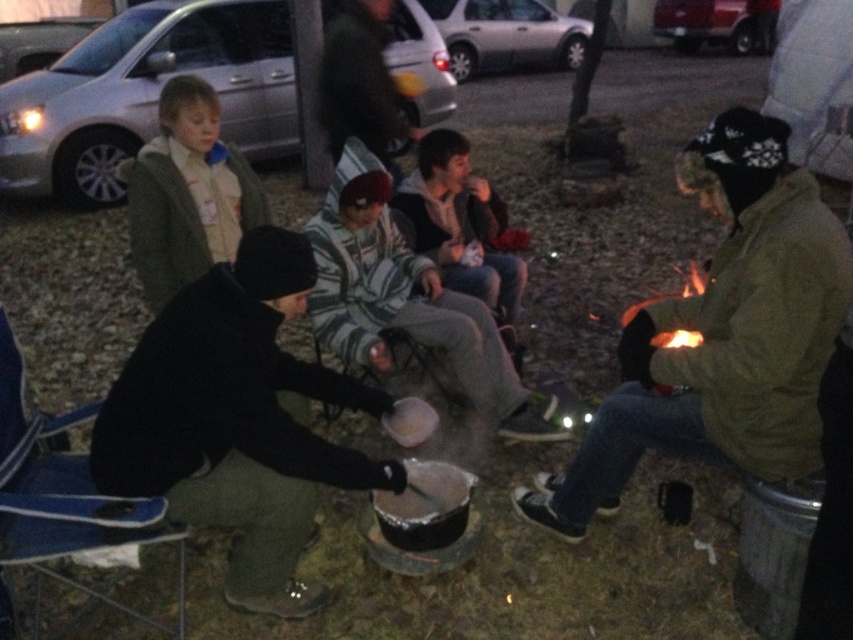
Between point (277, 262) and point (491, 392), which one is positioned behind?

Point (491, 392)

From the picture: Does black matte pot at center come behind striped fabric jacket at center?

No.

Between point (286, 500) and point (410, 288), which one is positioned in front?

Point (286, 500) is more forward.

This screenshot has height=640, width=853. I want to click on black matte pot at center, so click(x=236, y=420).

Is camouflage-patterned jacket at right wider than striped fabric jacket at center?

No, camouflage-patterned jacket at right is not wider than striped fabric jacket at center.

Between point (781, 266) and point (511, 396), which one is positioned in front?

Point (781, 266)

Locate an element on the screen. This screenshot has height=640, width=853. camouflage-patterned jacket at right is located at coordinates (722, 336).

Who is more distant from viewer, (805,230) or (294,300)?

The point (294,300) is more distant.

Is point (751, 429) positioned before point (349, 470)?

No, it is not.

From the picture: Who is more distant from viewer, (669,433) or (270,250)?

Positioned behind is point (669,433).

Find the location of a particular element. The width and height of the screenshot is (853, 640). camouflage-patterned jacket at right is located at coordinates (722, 336).